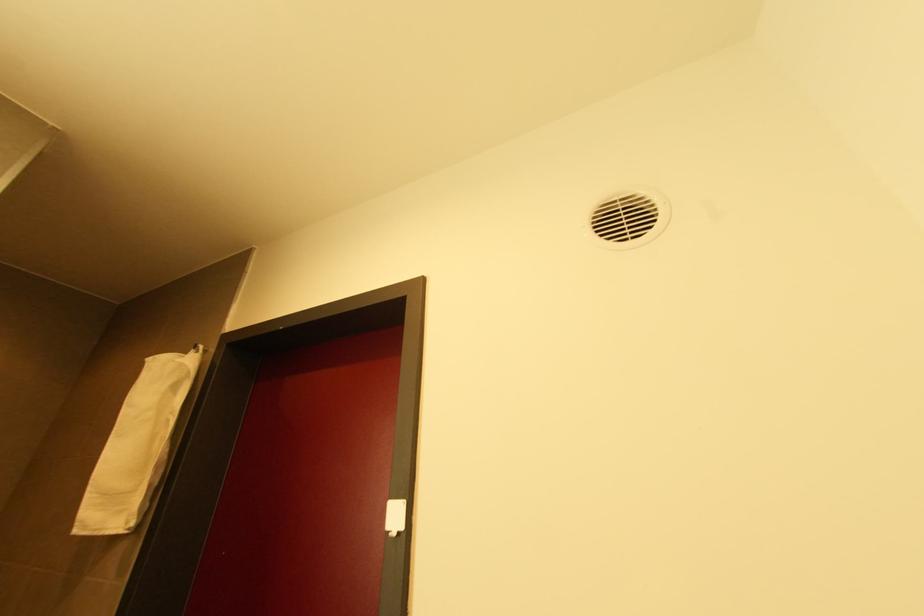
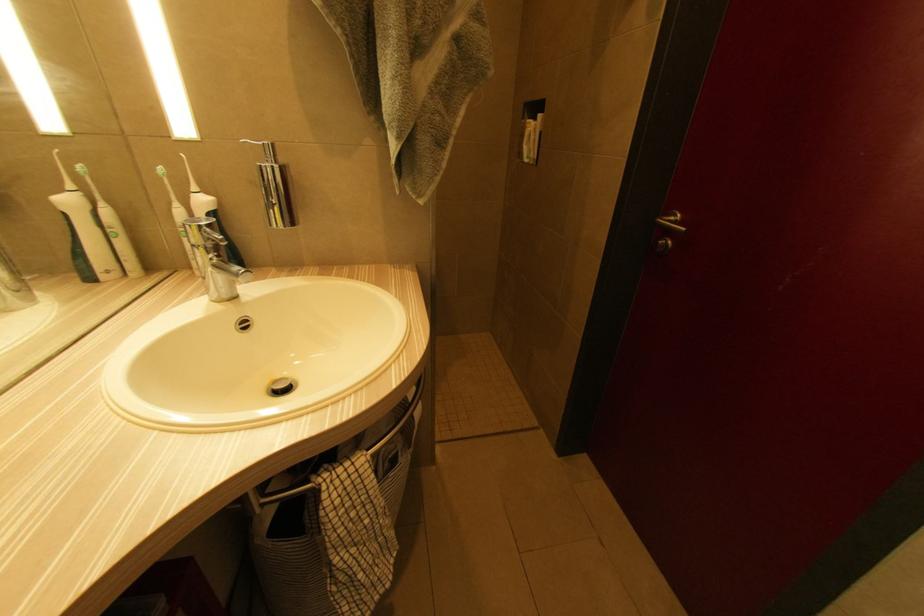
Looking at this image, the images are taken continuously from a first-person perspective. In which direction is your viewpoint rotating?

The rotation direction of the camera is left-down.